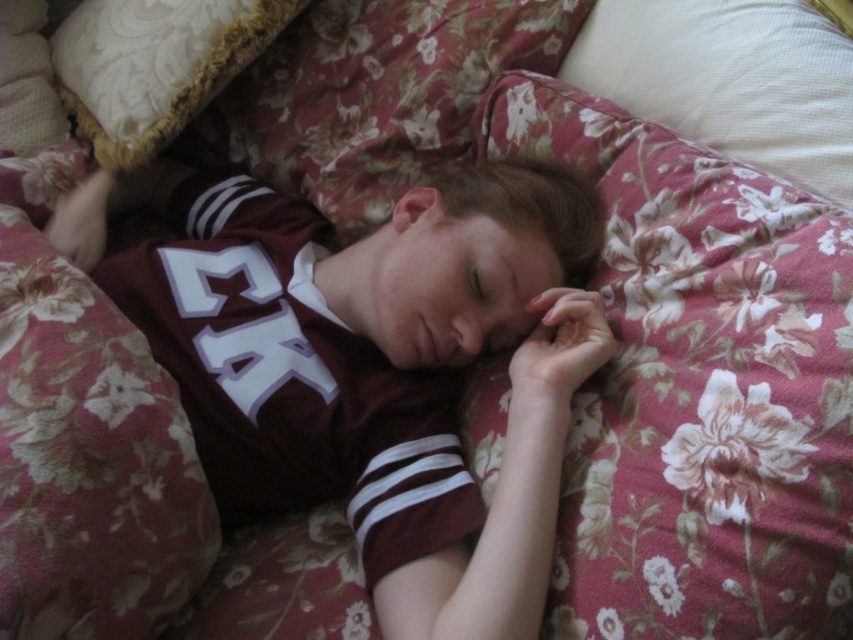
How much distance is there between floral fabric at upper center and velvet-like beige pillow at upper left?

floral fabric at upper center is 55.16 centimeters from velvet-like beige pillow at upper left.

Which is behind, point (640, 374) or point (68, 17)?

The point (68, 17) is behind.

Where is `floral fabric at upper center`? floral fabric at upper center is located at coordinates (698, 388).

You are a GUI agent. You are given a task and a screenshot of the screen. Output one action in this format:
    pyautogui.click(x=<x>, y=<y>)
    Task: Click on the floral fabric at upper center
    
    Given the screenshot: What is the action you would take?
    pyautogui.click(x=698, y=388)

I want to click on white textured pillow at upper right, so click(x=729, y=80).

Can you confirm if white textured pillow at upper right is thinner than velvet-like beige pillow at upper left?

Yes.

Locate an element on the screen. white textured pillow at upper right is located at coordinates click(729, 80).

Can you confirm if maroon jersey at center is bigger than floral fabric at upper center?

Correct, maroon jersey at center is larger in size than floral fabric at upper center.

Can you confirm if maroon jersey at center is positioned to the left of floral fabric at upper center?

Correct, you'll find maroon jersey at center to the left of floral fabric at upper center.

Between point (277, 461) and point (651, 244), which one is positioned in front?

Point (651, 244) is more forward.

You are a GUI agent. You are given a task and a screenshot of the screen. Output one action in this format:
    pyautogui.click(x=<x>, y=<y>)
    Task: Click on the maroon jersey at center
    This screenshot has height=640, width=853.
    Given the screenshot: What is the action you would take?
    pyautogui.click(x=370, y=364)